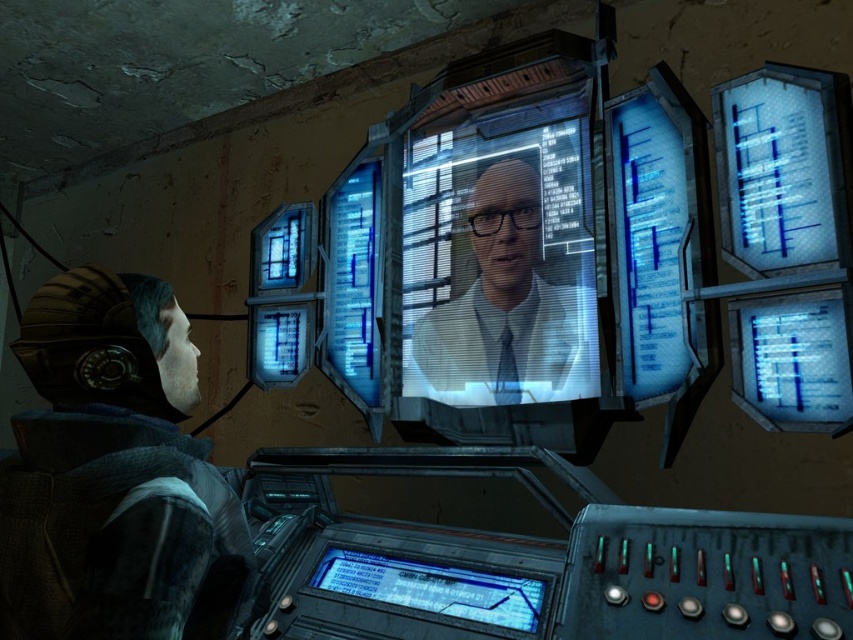
You are a technician in this room and need to access the blue transparent display at bottom center. However, your tools are on the matte white shirt at center. Can you reach the display without moving the tools?

The matte white shirt at center is positioned on the right side of blue transparent display at bottom center, so the tools on the matte white shirt at center are to the right of the display. Since the tools are not blocking the path, you can reach the blue transparent display at bottom center without moving them.

You are a technician in this room and need to adjust both the matte white shirt at center and the blue transparent display at bottom center. Which object do you need to reach higher to adjust?

The matte white shirt at center has a greater height compared to the blue transparent display at bottom center, so you need to reach higher to adjust the matte white shirt at center.